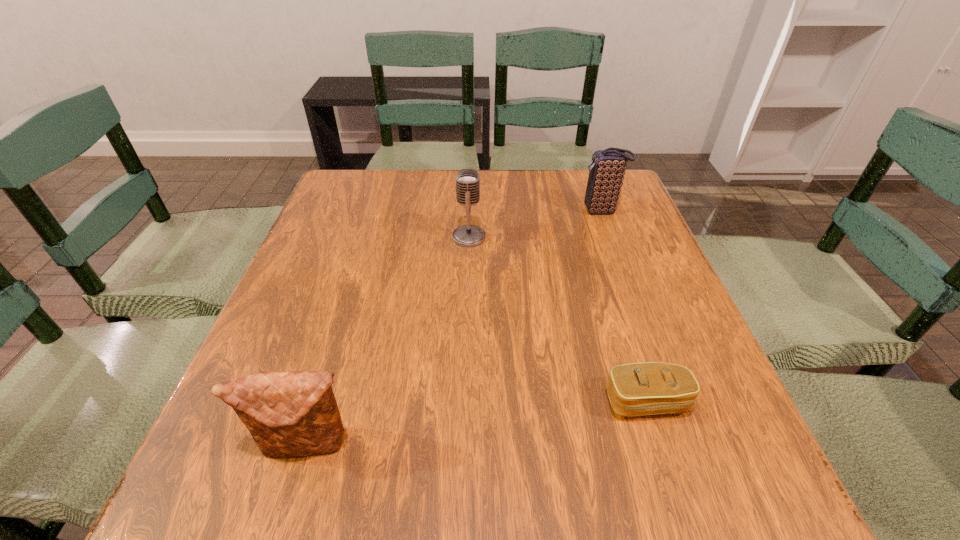
Locate an element on the screen. the third nearest object is located at coordinates (467, 180).

The width and height of the screenshot is (960, 540). I want to click on the second object from left to right, so click(x=467, y=180).

Locate an element on the screen. the farthest object is located at coordinates (606, 174).

Find the location of a particular element. the nearest clutch bag is located at coordinates (289, 413).

Identify the location of the nearest object. The image size is (960, 540). (289, 413).

In order to click on the shortest object in this screenshot , I will do `click(636, 389)`.

At what (x,y) coordinates should I click in order to perform the action: click on the shortest clutch bag. Please return your answer as a coordinate pair (x, y). Image resolution: width=960 pixels, height=540 pixels. Looking at the image, I should click on (636, 389).

The width and height of the screenshot is (960, 540). Find the location of `free location located on the back of the second object from left to right`. free location located on the back of the second object from left to right is located at coordinates (469, 214).

Locate an element on the screen. This screenshot has height=540, width=960. vacant space located 0.340m with the zip open on the farthest clutch bag is located at coordinates (453, 211).

The height and width of the screenshot is (540, 960). What are the coordinates of `free space located 0.260m with the zip open on the farthest clutch bag` in the screenshot? It's located at (483, 211).